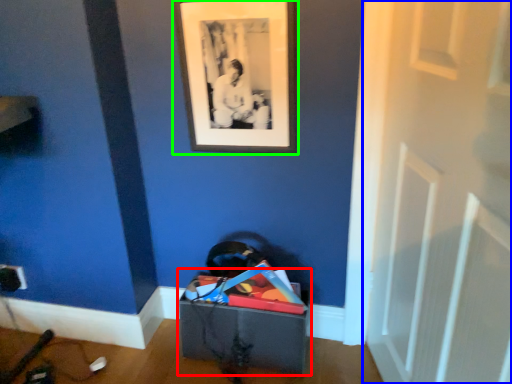
Question: Based on their relative distances, which object is farther from storage box (highlighted by a red box)? Choose from door (highlighted by a blue box) and picture frame (highlighted by a green box).

Choices:
 (A) door
 (B) picture frame

Answer: (B)